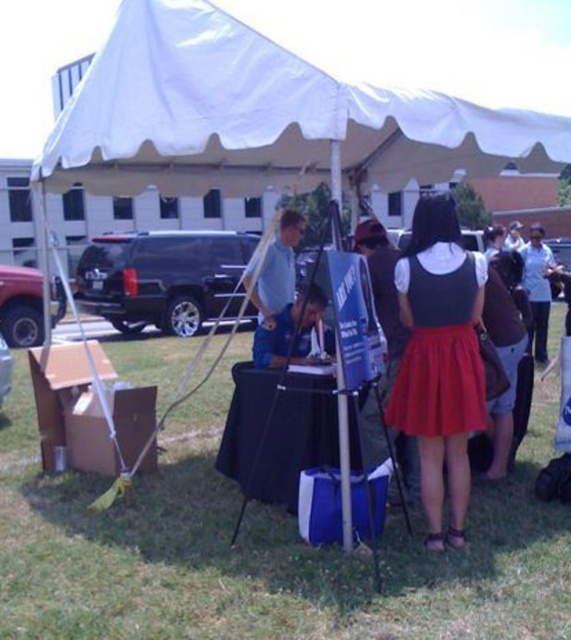
You are a photographer at the event and want to capture a clear photo of the red satin dress at center without the white fabric canopy at upper center blocking it. What should you do?

Move to a position where the red satin dress at center is no longer obscured by the white fabric canopy at upper center, since the red satin dress at center is currently behind the white fabric canopy at upper center.

Looking at this image, you are a photographer setting up for an outdoor event. You want to take a photo of the white fabric canopy at upper center and the red satin dress at center so that both are in the frame. Given that your camera has a maximum focal length that allows capturing objects up to 6 meters apart, will you be able to include both in the same shot?

The white fabric canopy at upper center and the red satin dress at center are 5.82 meters apart from each other. Since the maximum distance your camera can capture is up to 6 meters, you will be able to include both in the same shot as 5.82 meters is less than 6 meters.